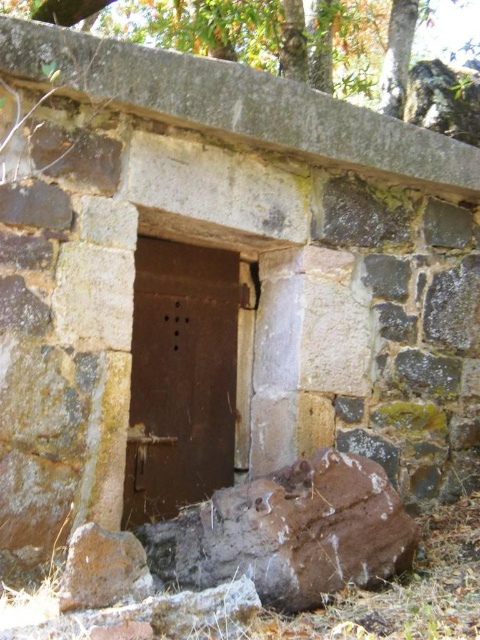
From the picture: You are standing in front of the old stone structure and notice two points marked on the doorway. Which point, point [169,337] or point [207,4], is closer to you?

Point [169,337] is closer to the viewer than point [207,4].

In the scene shown: You are standing in front of an old stone structure. You need to locate the rusty metal door at center. According to the coordinates provided, where exactly is it positioned?

The rusty metal door at center is located at point coordinates of (180, 378).

You are standing in front of an old stone structure. You see a brown rough stone at lower center and a rusty metal door at center. Which object is closer to you?

The brown rough stone at lower center is closer to you because it is in front of the rusty metal door at center.